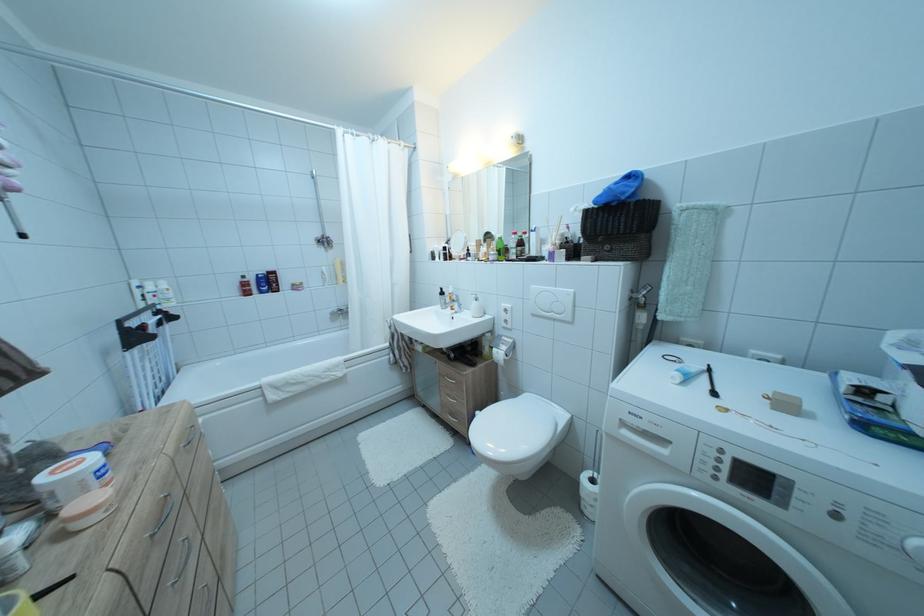
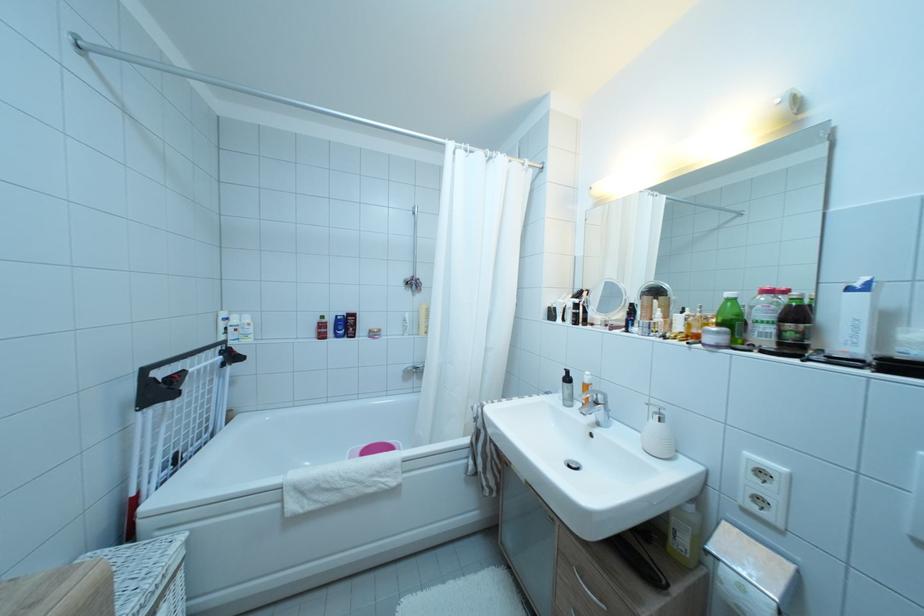
Locate, in the second image, the point that corresponds to point 325,185 in the first image.

(428, 222)